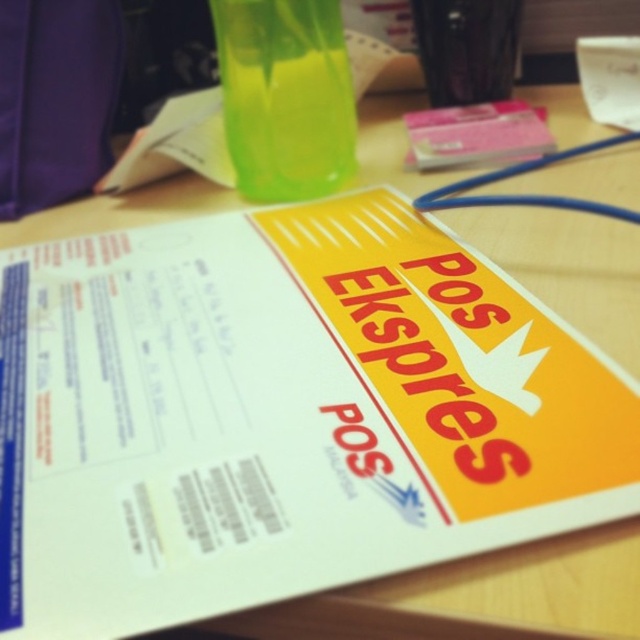
Between point (268, 115) and point (10, 118), which one is positioned behind?

The point (10, 118) is behind.

Is point (300, 125) closer to viewer compared to point (17, 129)?

Yes, point (300, 125) is closer to viewer.

The image size is (640, 640). In order to click on translucent green cup at upper center in this screenshot , I will do `click(285, 97)`.

Can you confirm if translucent green cup at upper center is thinner than transparent plastic cup at upper center?

No, translucent green cup at upper center is not thinner than transparent plastic cup at upper center.

Which is in front, point (300, 3) or point (444, 65)?

Point (300, 3) is in front.

Which is behind, point (317, 0) or point (496, 81)?

The point (496, 81) is more distant.

Where is `translucent green cup at upper center`? The image size is (640, 640). translucent green cup at upper center is located at coordinates (285, 97).

Consider the image. Does purple fabric bag at upper left appear under transparent plastic cup at upper center?

Indeed, purple fabric bag at upper left is positioned under transparent plastic cup at upper center.

Between point (4, 77) and point (512, 60), which one is positioned in front?

Point (4, 77)

Does point (56, 24) lie in front of point (499, 68)?

Yes, it is in front of point (499, 68).

Find the location of a particular element. The width and height of the screenshot is (640, 640). purple fabric bag at upper left is located at coordinates (54, 99).